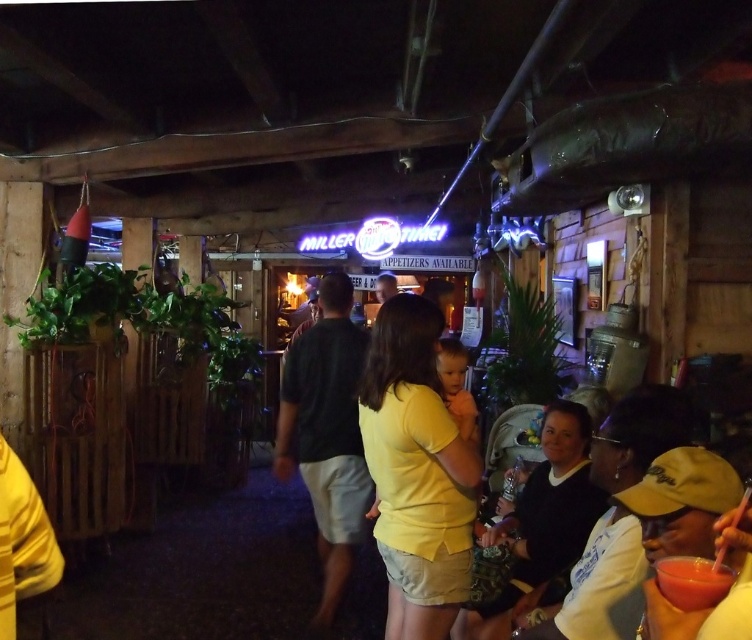
Does yellow matte shirt at center appear under smooth matte red drink at lower right?

Correct, yellow matte shirt at center is located below smooth matte red drink at lower right.

Is point (408, 346) more distant than point (690, 605)?

That is True.

At what (x,y) coordinates should I click in order to perform the action: click on yellow matte shirt at center. Please return your answer as a coordinate pair (x, y). Image resolution: width=752 pixels, height=640 pixels. Looking at the image, I should click on (417, 472).